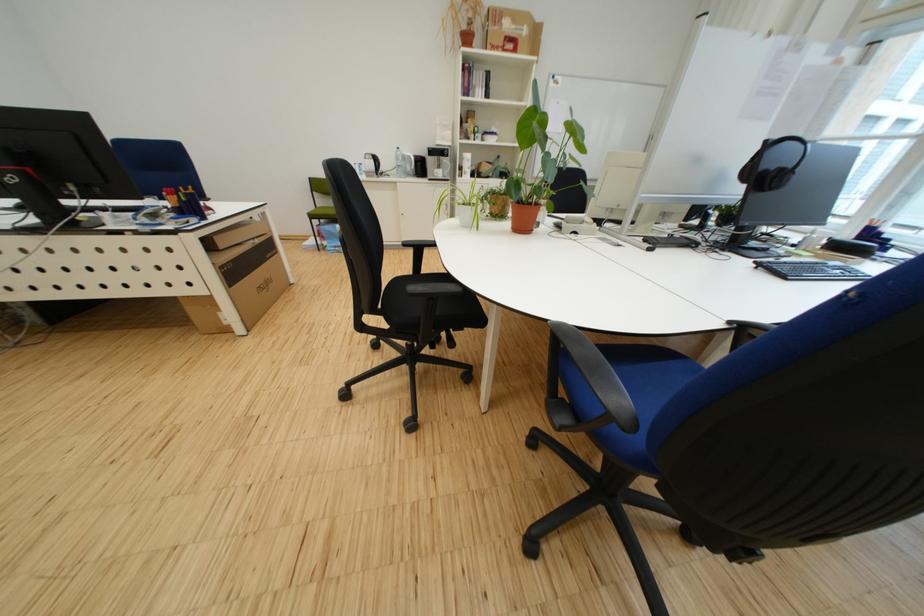
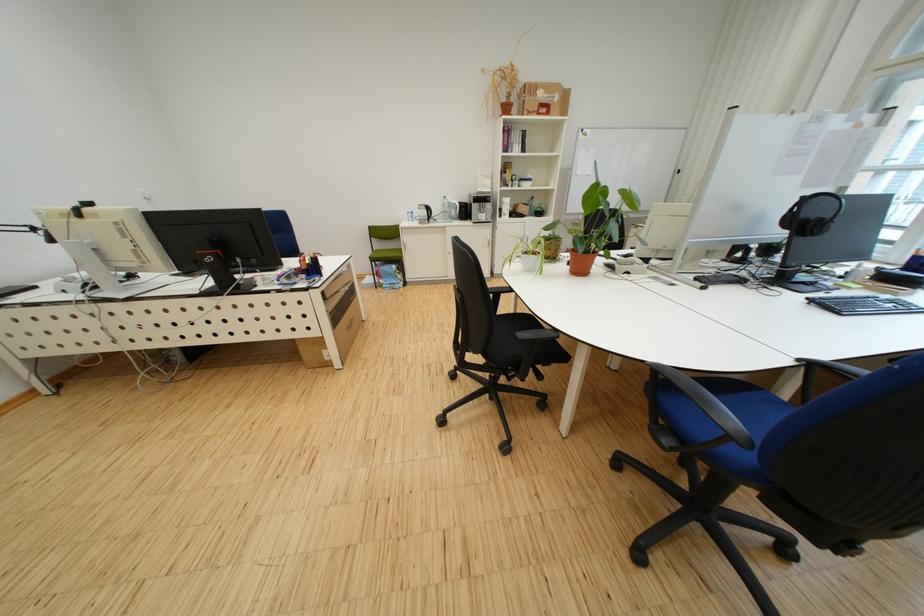
In the second image, find the point that corresponds to point (558, 322) in the first image.

(655, 363)